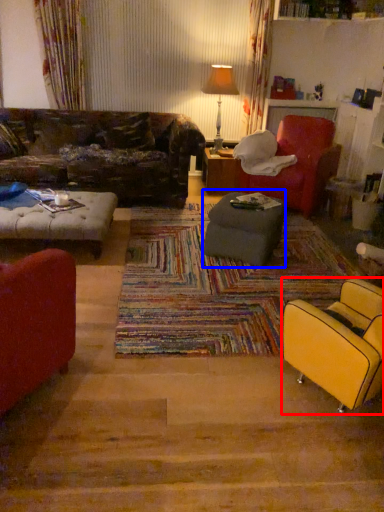
Question: Which point is closer to the camera, chair (highlighted by a red box) or table (highlighted by a blue box)?

Choices:
 (A) chair
 (B) table

Answer: (A)